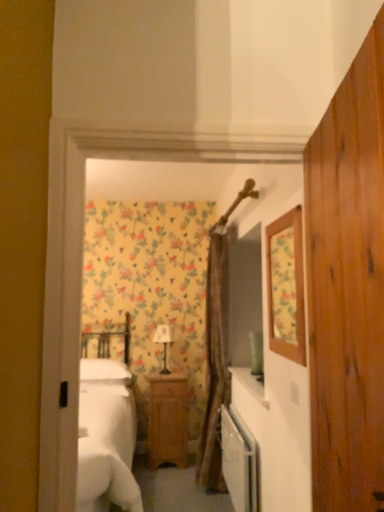
The height and width of the screenshot is (512, 384). In order to click on free space to the left of brown textured curtain at center in this screenshot , I will do `click(170, 492)`.